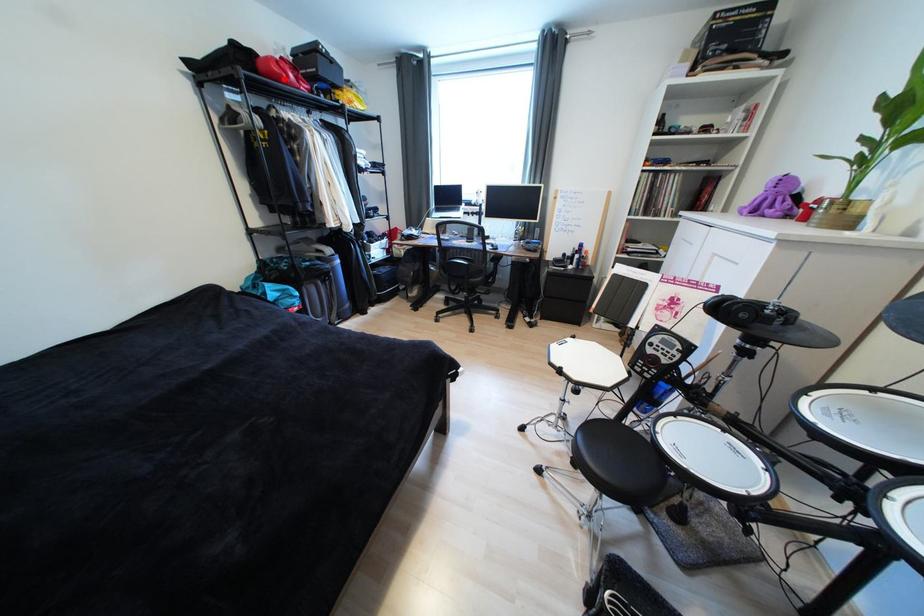
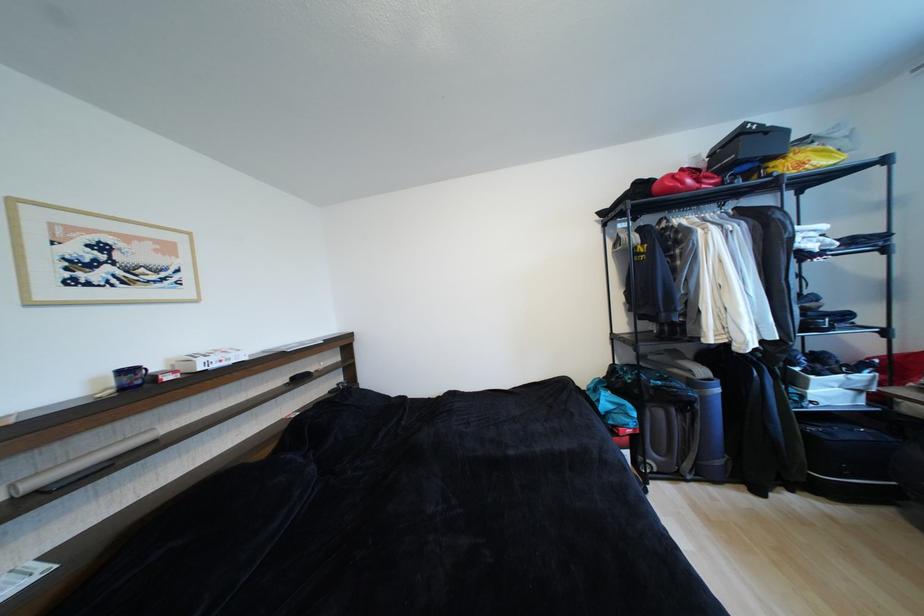
Where in the second image is the point corresponding to the highlighted location from the first image?

(676, 192)